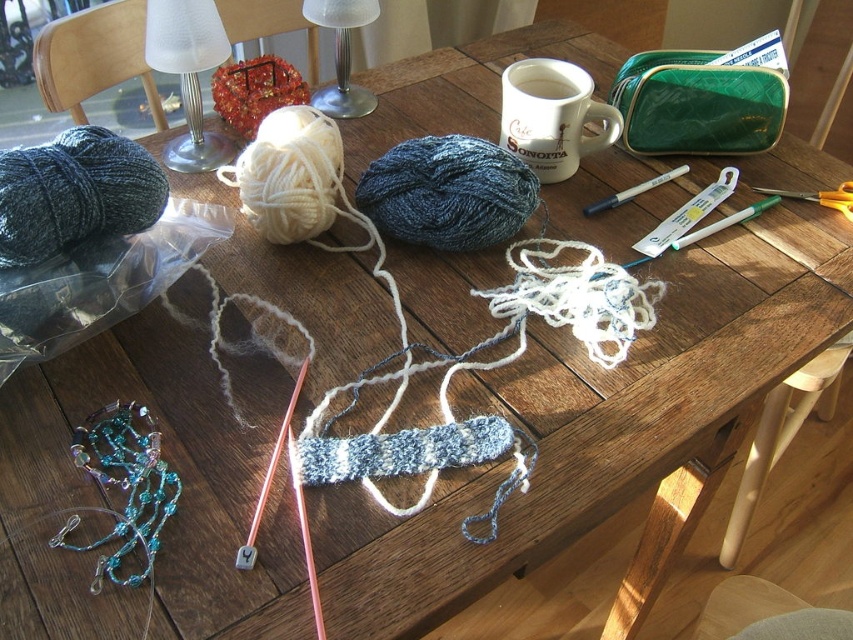
You are setting up a photography studio and need to decide which lamp to use for softer lighting. The white frosted glass lamp at upper left and the white frosted glass lamp at upper center are both available. Which one should you choose based on their size?

The white frosted glass lamp at upper left is larger in size than the white frosted glass lamp at upper center, so you should choose the white frosted glass lamp at upper left for softer lighting since larger lamps typically diffuse light more effectively.

You are organizing a craft fair and need to display all yarn skeins. The dark blue yarn at center is currently placed at point 0.302, 0.525. Where should you move it to ensure it aligns with the other yarn skeins on the table?

The dark blue yarn at center should be moved to the left side of the table where the other yarn skeins are located.